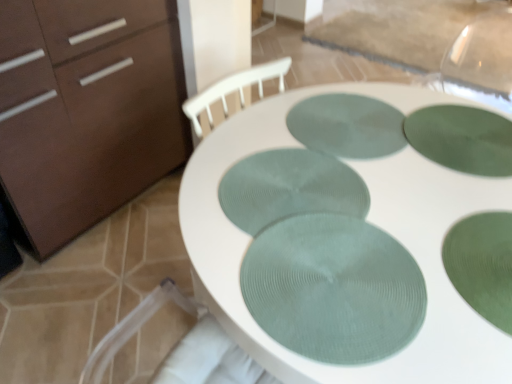
The height and width of the screenshot is (384, 512). In order to click on vacant space in between green textured glass plate at center, the third glass plate when ordered from front to back, and green textured glass at center, positioned as the fourth glass plate in back-to-front order in this screenshot , I will do `click(397, 241)`.